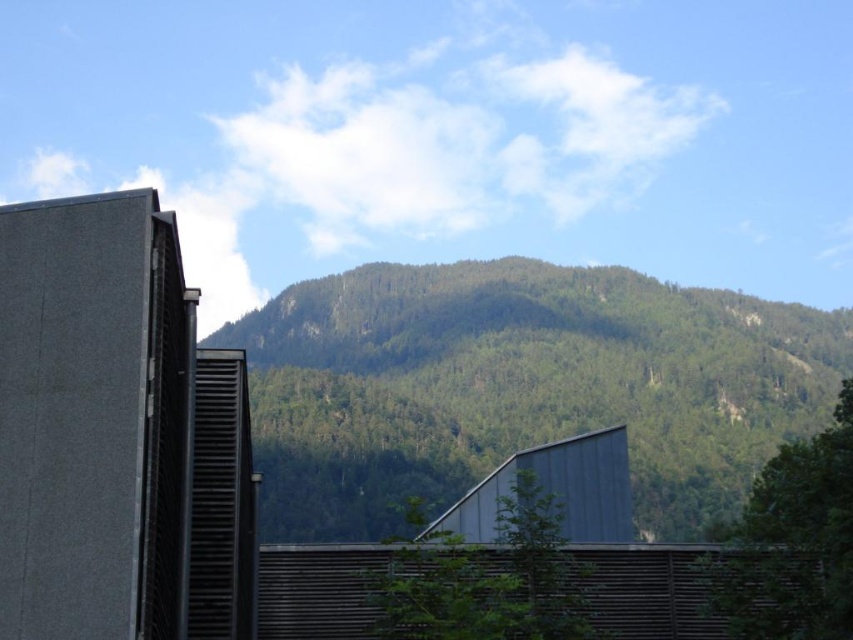
Can you confirm if green forested mountain at center is smaller than green leafy tree at right?

No.

Is point (386, 305) farther from camera compared to point (770, 598)?

Yes, it is.

What do you see at coordinates (521, 387) in the screenshot?
I see `green forested mountain at center` at bounding box center [521, 387].

You are a GUI agent. You are given a task and a screenshot of the screen. Output one action in this format:
    pyautogui.click(x=<x>, y=<y>)
    Task: Click on the green forested mountain at center
    The width and height of the screenshot is (853, 640).
    Given the screenshot: What is the action you would take?
    pyautogui.click(x=521, y=387)

Does green leafy tree at right appear under green leafy tree at center?

Yes.

Where is `green leafy tree at right`? Image resolution: width=853 pixels, height=640 pixels. green leafy tree at right is located at coordinates (792, 541).

Which is in front, point (766, 380) or point (416, 627)?

Point (416, 627) is in front.

Locate an element on the screen. green forested mountain at center is located at coordinates (521, 387).